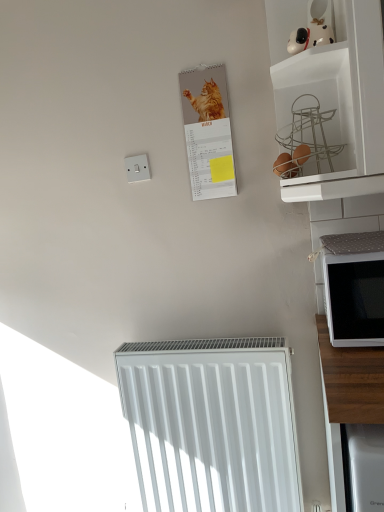
Question: Considering the positions of white matte microwave at right and white smooth radiator at lower center in the image, is white matte microwave at right wider or thinner than white smooth radiator at lower center?

Choices:
 (A) thin
 (B) wide

Answer: (B)

Question: Is point (332, 266) positioned closer to the camera than point (261, 430)?

Choices:
 (A) farther
 (B) closer

Answer: (B)

Question: Based on their relative distances, which object is nearer to the white smooth radiator at lower center?

Choices:
 (A) white matte wire basket at upper right
 (B) matte paper calendar at upper center
 (C) white plastic switch at upper left
 (D) white matte microwave at right

Answer: (D)

Question: Which is farther from the white plastic switch at upper left?

Choices:
 (A) matte paper calendar at upper center
 (B) white matte microwave at right
 (C) white smooth radiator at lower center
 (D) white matte wire basket at upper right

Answer: (C)